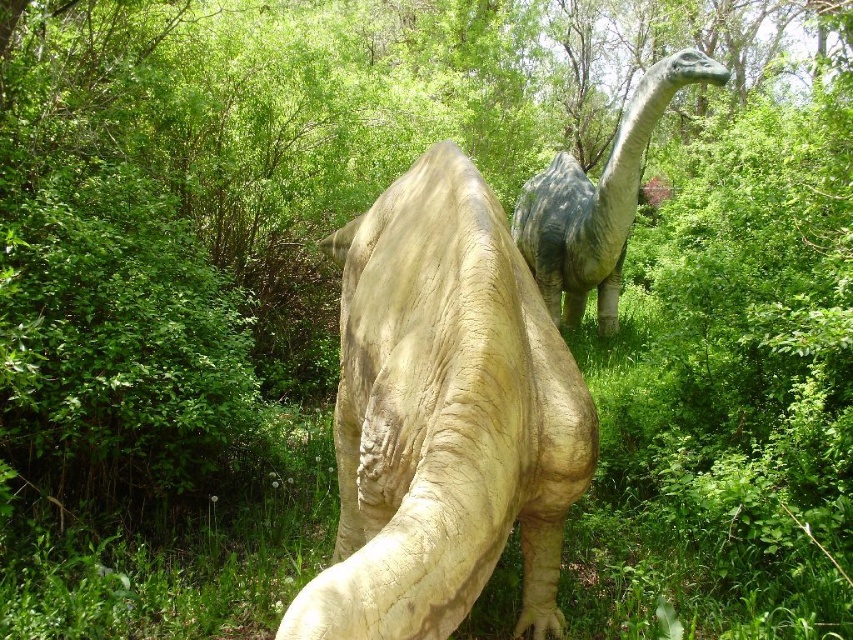
You are a child trying to decide which dinosaur to play with first. You see the matte beige dinosaur at center and the shiny gray dinosaur at center. Which one is located more to the left?

The matte beige dinosaur at center is positioned on the left side of the shiny gray dinosaur at center, so it is more to the left.

You are a photographer standing at the camera position. You want to take a photo of the matte beige dinosaur at center. However, there is a small bush blocking your view. The bush is 4.5 feet away from you. Can you move forward to get a clear shot without stepping on the bush?

The matte beige dinosaur at center is 5.28 feet from the camera. The bush is 4.5 feet away from you. If you move forward to 4.5 feet, you would be at the same distance as the bush, which is blocking the view. To get a clear shot, you need to be closer than 4.5 feet, but that would mean stepping into the bush. Therefore, you cannot move forward without stepping on the bush.

You are standing in the lush green outdoor setting described. You want to place a small garden gnome exactly where the matte beige dinosaur at center is currently located. What are the coordinates you should input into your GPS device to place the gnome there?

The coordinates for the matte beige dinosaur at center are 0.652 in the x axis and 0.521 in the y axis, so you should input those coordinates into your GPS device to place the gnome there.